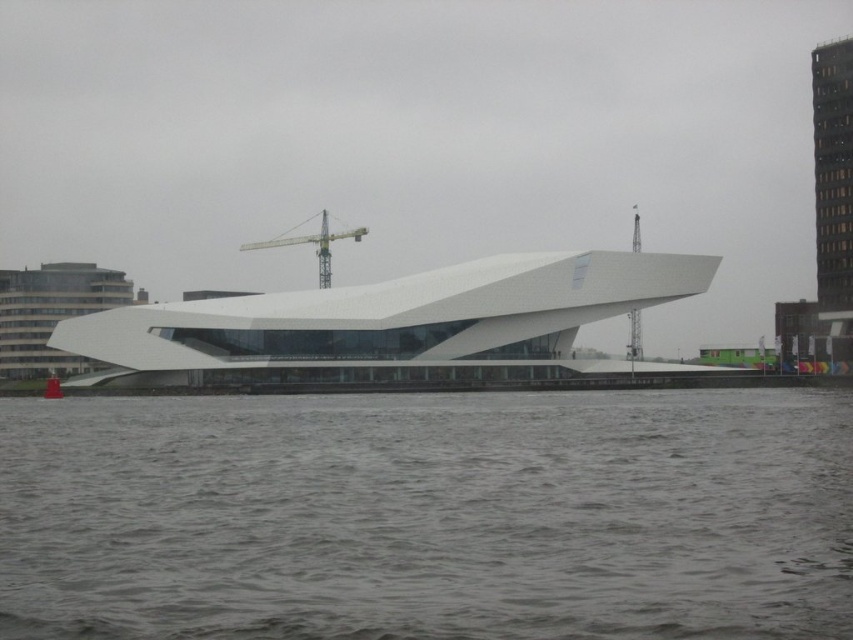
You are standing at the point marked by the coordinates point (428, 516) in the image. What is the immediate surface you are standing on?

The point (428, 516) indicates gray water at lower center, so you are standing on gray water at lower center.

You are standing at the waterfront looking at the modern building. There are two points marked on the structure. Which of the two points, point [624,550] or point [277,244], is closer to you?

Point [624,550] is closer to the viewer than point [277,244].

You are an architect reviewing a model of a waterfront building. The model includes a gray water at lower center and a yellow metallic crane at center. Which object in the model takes up more space?

The yellow metallic crane at center takes up more space than the gray water at lower center because the gray water at lower center occupies less space than yellow metallic crane at center.